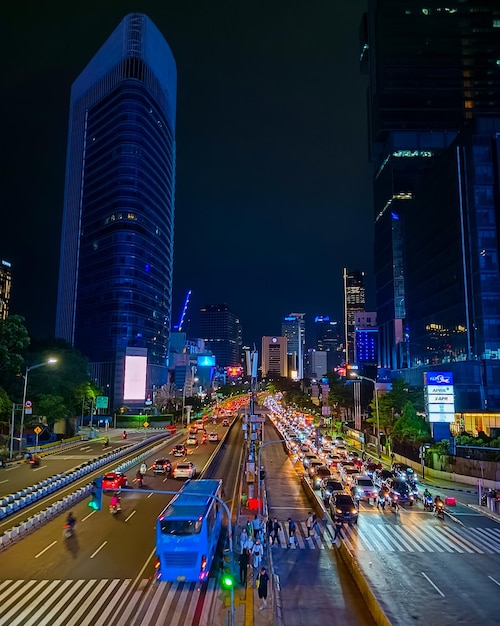
Locate an element on the screen. The height and width of the screenshot is (626, 500). divider is located at coordinates (279, 449).